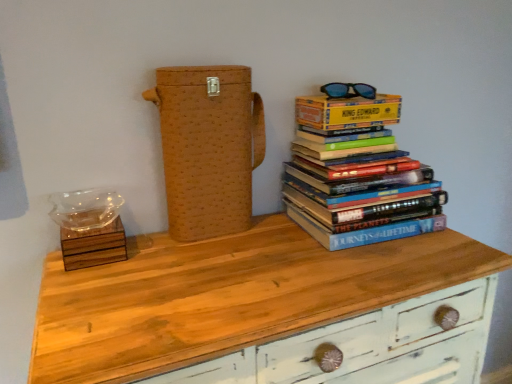
Describe the element at coordinates (347, 111) in the screenshot. I see `yellow paper at upper right` at that location.

What do you see at coordinates (357, 175) in the screenshot?
I see `hardcover books at upper right` at bounding box center [357, 175].

Where is `yellow paper at upper right`? yellow paper at upper right is located at coordinates point(347,111).

Between point (115, 356) and point (329, 84), which one is positioned behind?

The point (329, 84) is farther from the camera.

Considering the sizes of wooden chest of drawers at center and blue plastic sunglasses at upper right in the image, is wooden chest of drawers at center wider or thinner than blue plastic sunglasses at upper right?

Considering their sizes, wooden chest of drawers at center looks broader than blue plastic sunglasses at upper right.

Does wooden chest of drawers at center come behind blue plastic sunglasses at upper right?

No, wooden chest of drawers at center is in front of blue plastic sunglasses at upper right.

Which of these two, brown woven box at center or blue plastic sunglasses at upper right, stands taller?

brown woven box at center is taller.

In the scene shown: Looking at their sizes, would you say brown woven box at center is wider or thinner than blue plastic sunglasses at upper right?

In the image, brown woven box at center appears to be wider than blue plastic sunglasses at upper right.

In the image, is brown woven box at center positioned in front of or behind blue plastic sunglasses at upper right?

Visually, brown woven box at center is located in front of blue plastic sunglasses at upper right.

Is blue plastic sunglasses at upper right completely or partially inside hardcover books at upper right?

Definitely not — blue plastic sunglasses at upper right is not inside hardcover books at upper right.

In terms of height, does hardcover books at upper right look taller or shorter compared to blue plastic sunglasses at upper right?

Considering their sizes, hardcover books at upper right has more height than blue plastic sunglasses at upper right.

Is hardcover books at upper right facing away from blue plastic sunglasses at upper right?

hardcover books at upper right does not have its back to blue plastic sunglasses at upper right.

From a real-world perspective, is hardcover books at upper right positioned above or below blue plastic sunglasses at upper right?

hardcover books at upper right is situated lower than blue plastic sunglasses at upper right in the real world.

Relative to brown woven box at center, is yellow paper at upper right in front or behind?

In the image, yellow paper at upper right appears behind brown woven box at center.

Can you confirm if yellow paper at upper right is positioned to the left of brown woven box at center?

No.

From the image's perspective, is yellow paper at upper right located beneath brown woven box at center?

No.

Are yellow paper at upper right and brown woven box at center making contact?

No, yellow paper at upper right is not with brown woven box at center.

Is yellow paper at upper right a part of wooden chest of drawers at center?

No, wooden chest of drawers at center does not contain yellow paper at upper right.

From a real-world perspective, who is located higher, wooden chest of drawers at center or yellow paper at upper right?

From a 3D spatial view, yellow paper at upper right is above.

Considering the positions of point (349, 286) and point (335, 103), is point (349, 286) closer or farther from the camera than point (335, 103)?

Point (349, 286) is closer to the camera than point (335, 103).

What's the angular difference between wooden chest of drawers at center and yellow paper at upper right's facing directions?

They differ by 3.97 degrees in their facing directions.

How much distance is there between yellow paper at upper right and blue plastic sunglasses at upper right?

The distance of yellow paper at upper right from blue plastic sunglasses at upper right is 2.00 inches.

From a real-world perspective, is yellow paper at upper right positioned above or below blue plastic sunglasses at upper right?

yellow paper at upper right is situated lower than blue plastic sunglasses at upper right in the real world.

The width and height of the screenshot is (512, 384). What are the coordinates of `glasses behind the yellow paper at upper right` in the screenshot? It's located at (349, 90).

Considering the sizes of yellow paper at upper right and blue plastic sunglasses at upper right in the image, is yellow paper at upper right taller or shorter than blue plastic sunglasses at upper right?

Considering their sizes, yellow paper at upper right has more height than blue plastic sunglasses at upper right.

Considering the sizes of objects hardcover books at upper right and yellow paper at upper right in the image provided, who is thinner, hardcover books at upper right or yellow paper at upper right?

Thinner between the two is yellow paper at upper right.

How far apart are hardcover books at upper right and yellow paper at upper right?

The distance of hardcover books at upper right from yellow paper at upper right is 4.17 inches.

Is there a large distance between hardcover books at upper right and yellow paper at upper right?

hardcover books at upper right is near yellow paper at upper right, not far away.

Locate an element on the screen. chest of drawers on the left of blue plastic sunglasses at upper right is located at coordinates (229, 294).

Locate an element on the screen. This screenshot has width=512, height=384. cardboard box below the blue plastic sunglasses at upper right (from a real-world perspective) is located at coordinates (208, 147).

From the image, which object appears to be nearer to yellow paper at upper right, blue plastic sunglasses at upper right or wooden chest of drawers at center?

blue plastic sunglasses at upper right is positioned closer to the anchor yellow paper at upper right.

Estimate the real-world distances between objects in this image. Which object is closer to yellow paper at upper right, hardcover books at upper right or brown woven box at center?

hardcover books at upper right.

Consider the image. Estimate the real-world distances between objects in this image. Which object is further from blue plastic sunglasses at upper right, brown woven box at center or hardcover books at upper right?

The object further to blue plastic sunglasses at upper right is brown woven box at center.

Considering their positions, is brown woven box at center positioned further to hardcover books at upper right than yellow paper at upper right?

Based on the image, brown woven box at center appears to be further to hardcover books at upper right.

Based on their spatial positions, is wooden chest of drawers at center or blue plastic sunglasses at upper right further from yellow paper at upper right?

wooden chest of drawers at center lies further to yellow paper at upper right than the other object.

Which object lies further to the anchor point brown woven box at center, blue plastic sunglasses at upper right or yellow paper at upper right?

blue plastic sunglasses at upper right lies further to brown woven box at center than the other object.

Based on their spatial positions, is wooden chest of drawers at center or blue plastic sunglasses at upper right further from hardcover books at upper right?

wooden chest of drawers at center is positioned further to the anchor hardcover books at upper right.

From the image, which object appears to be farther from blue plastic sunglasses at upper right, wooden chest of drawers at center or brown woven box at center?

wooden chest of drawers at center.

This screenshot has height=384, width=512. Identify the location of book between yellow paper at upper right and wooden chest of drawers at center vertically. (357, 175).

You are a GUI agent. You are given a task and a screenshot of the screen. Output one action in this format:
    pyautogui.click(x=<x>, y=<y>)
    Task: Click on the paperback book situated between brown woven box at center and hardcover books at upper right from left to right
    This screenshot has height=384, width=512.
    Given the screenshot: What is the action you would take?
    pyautogui.click(x=347, y=111)

Locate an element on the screen. Image resolution: width=512 pixels, height=384 pixels. book between blue plastic sunglasses at upper right and wooden chest of drawers at center in the up-down direction is located at coordinates (357, 175).

In order to click on cardboard box that lies between blue plastic sunglasses at upper right and wooden chest of drawers at center from top to bottom in this screenshot , I will do `click(208, 147)`.